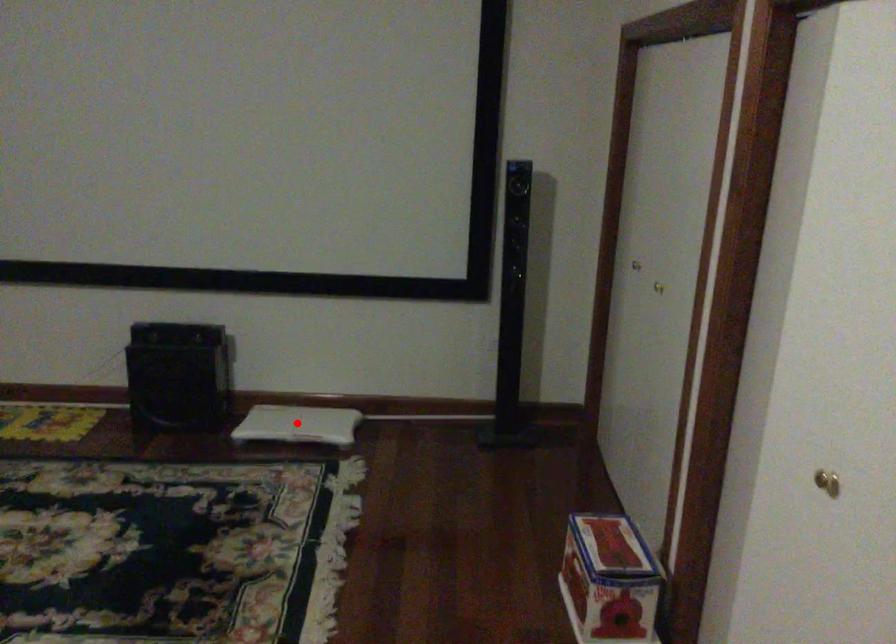
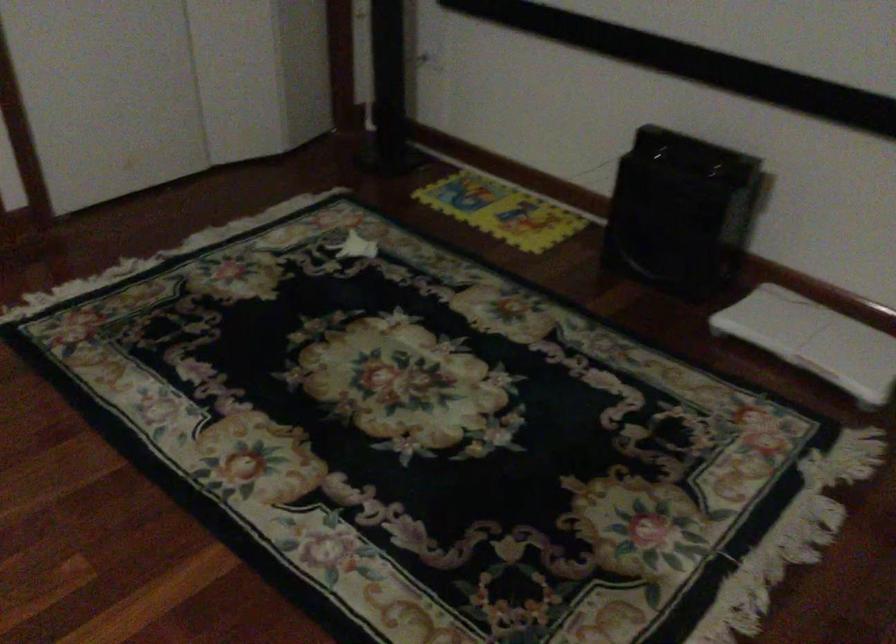
Question: I am providing you with two images of the same scene from different viewpoints. In image1, a red point is highlighted. Considering the same 3D point in image2, which of the following is correct?

Choices:
 (A) It is closer
 (B) It is farther

Answer: (A)